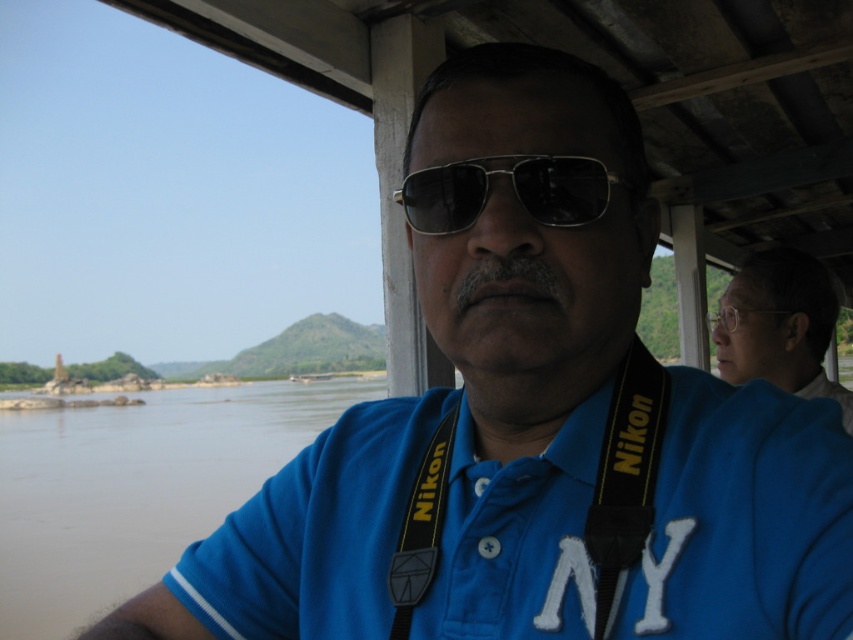
Question: Is blue cotton shirt at center below white matte glasses at upper right?

Choices:
 (A) no
 (B) yes

Answer: (B)

Question: Which of the following is the closest to the observer?

Choices:
 (A) (757, 333)
 (B) (755, 308)
 (C) (16, 637)

Answer: (B)

Question: Where is blue cotton shirt at center located in relation to black fabric nikon strap at center in the image?

Choices:
 (A) below
 (B) above

Answer: (A)

Question: Considering the real-world distances, which object is closest to the brown muddy water at lower left?

Choices:
 (A) black fabric nikon strap at center
 (B) clear plastic glasses at upper right

Answer: (A)

Question: Which object appears farthest from the camera in this image?

Choices:
 (A) brown muddy water at lower left
 (B) white matte glasses at upper right
 (C) clear plastic glasses at upper right
 (D) metallic reflective sunglasses at center

Answer: (C)

Question: Does blue cotton shirt at center have a larger size compared to metallic reflective sunglasses at center?

Choices:
 (A) no
 (B) yes

Answer: (B)